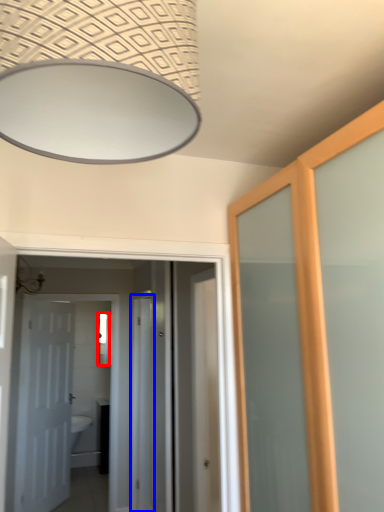
Question: Which object appears closest to the camera in this image, mirror (highlighted by a red box) or screen door (highlighted by a blue box)?

Choices:
 (A) mirror
 (B) screen door

Answer: (B)